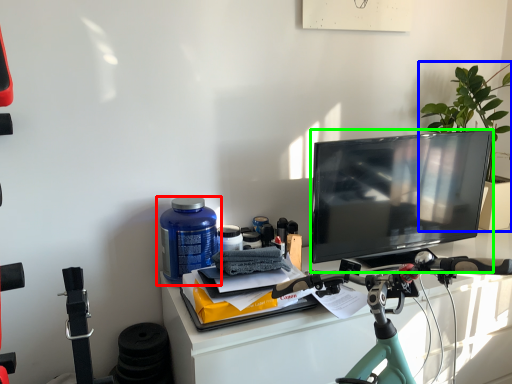
Question: Based on their relative distances, which object is farther from bottle (highlighted by a red box)? Choose from houseplant (highlighted by a blue box) and television (highlighted by a green box).

Choices:
 (A) houseplant
 (B) television

Answer: (A)